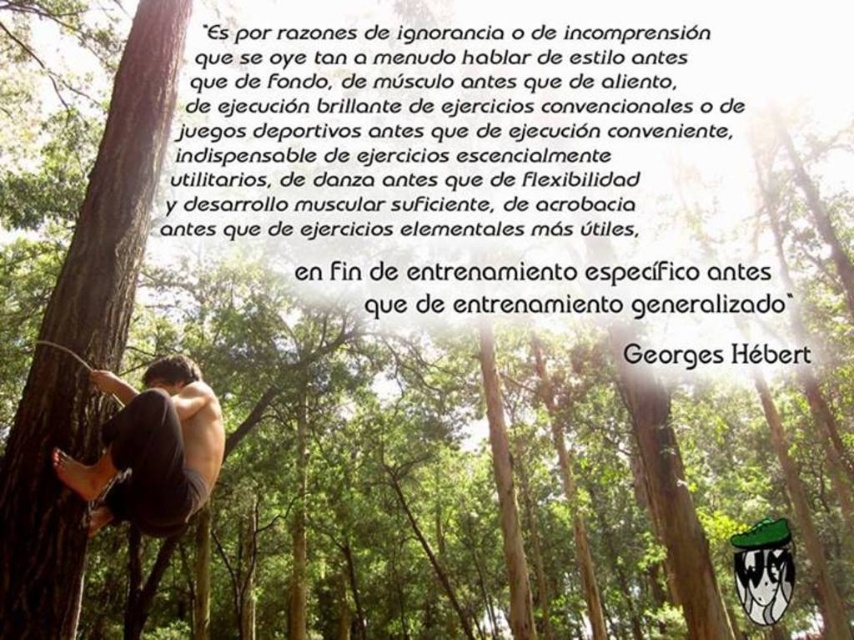
You are standing in the forest and see two points marked in the scene. Which point is closer to you, point (91,284) or point (161,497)?

Point (91,284) is further to the viewer than point (161,497), so the closer point is point (161,497).

You are a hiker who wants to take a photo of the brown rough bark tree at left and the dark gray fabric pants at lower left. Which object should you focus on first if you want to capture both in the same frame without moving the camera?

The brown rough bark tree at left is positioned on the left side of dark gray fabric pants at lower left, so you should focus on the brown rough bark tree at left first since it is closer to the camera than the dark gray fabric pants at lower left.

You are a hiker who wants to know if the brown rough bark tree at left is positioned higher than the dark gray fabric pants at lower left. Based on the scene description, can you confirm this?

The brown rough bark tree at left is located above the dark gray fabric pants at lower left, so yes, it is positioned higher.